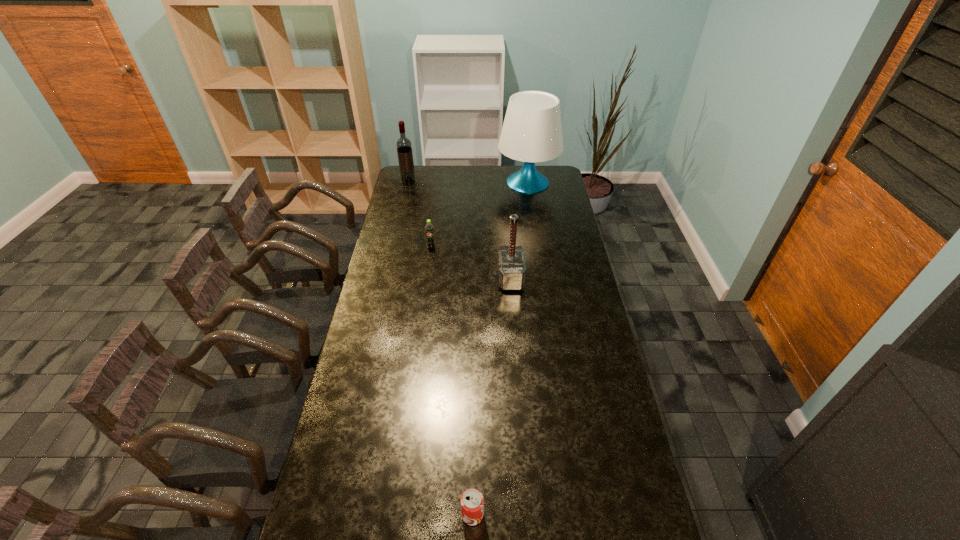
The width and height of the screenshot is (960, 540). Find the location of `table lamp`. table lamp is located at coordinates (532, 131).

Find the location of a particular element. The height and width of the screenshot is (540, 960). wine bottle is located at coordinates (404, 147).

What are the coordinates of `hammer` in the screenshot? It's located at (511, 267).

In order to click on the fourth tallest object in this screenshot , I will do `click(429, 228)`.

Find the location of `the left soda can`. the left soda can is located at coordinates (429, 228).

The image size is (960, 540). In order to click on the shorter soda can in this screenshot , I will do `click(472, 502)`.

I want to click on the nearer soda can, so click(x=472, y=502).

At what (x,y) coordinates should I click in order to perform the action: click on vacant area located 0.200m on the front-facing side of the table lamp. Please return your answer as a coordinate pair (x, y). This screenshot has height=540, width=960. Looking at the image, I should click on (461, 183).

At what (x,y) coordinates should I click in order to perform the action: click on vacant region located 0.060m on the front-facing side of the table lamp. Please return your answer as a coordinate pair (x, y). Image resolution: width=960 pixels, height=540 pixels. Looking at the image, I should click on (486, 183).

Where is `vacant space located 0.140m on the front-facing side of the table lamp`? The image size is (960, 540). vacant space located 0.140m on the front-facing side of the table lamp is located at coordinates (471, 183).